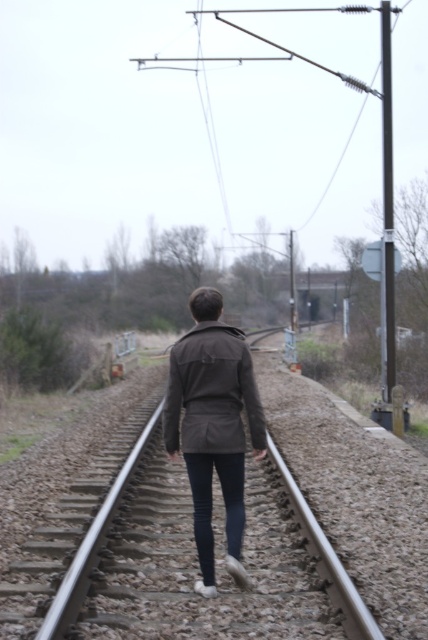
Question: Is dark brown matte jacket at center to the right of smooth metal train track at center from the viewer's perspective?

Choices:
 (A) no
 (B) yes

Answer: (B)

Question: Does dark brown matte jacket at center appear on the left side of smooth metal train track at center?

Choices:
 (A) no
 (B) yes

Answer: (A)

Question: Which object is positioned farthest from the dark brown jacket at center?

Choices:
 (A) dark brown matte jacket at center
 (B) smooth metal train track at center

Answer: (B)

Question: Which point appears closest to the camera in this image?

Choices:
 (A) (196, 372)
 (B) (234, 545)
 (C) (267, 336)

Answer: (A)

Question: Which object appears farthest from the camera in this image?

Choices:
 (A) dark brown matte jacket at center
 (B) dark brown jacket at center
 (C) smooth metal train track at center

Answer: (B)

Question: Can you confirm if dark brown matte jacket at center is bigger than smooth metal train track at center?

Choices:
 (A) no
 (B) yes

Answer: (A)